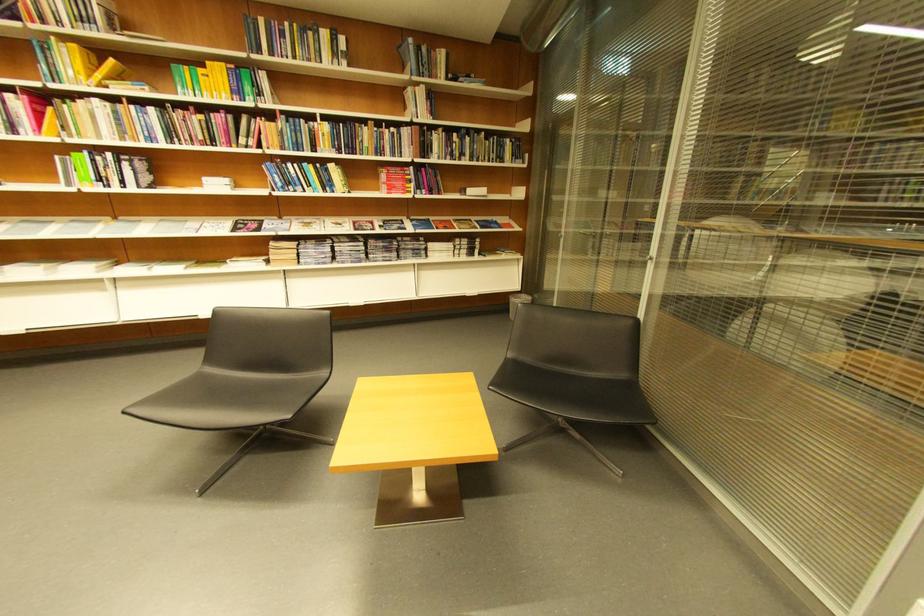
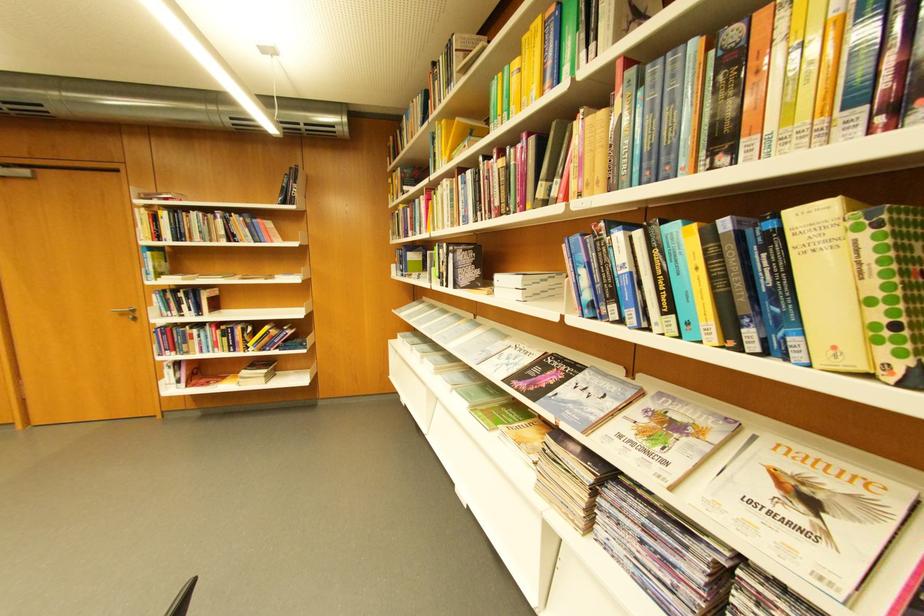
In the second image, find the point that corresponds to (x=321, y=188) in the first image.

(681, 310)